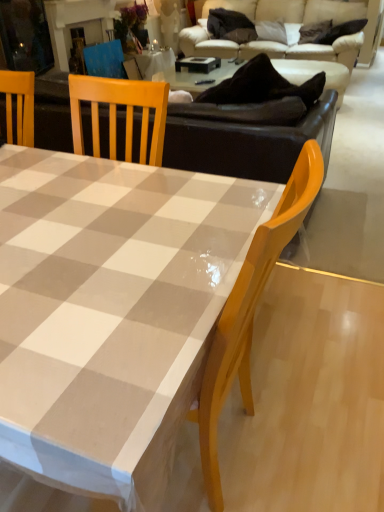
Question: In terms of height, does beige fabric couch at upper center look taller or shorter compared to white glossy table at center?

Choices:
 (A) tall
 (B) short

Answer: (A)

Question: Is beige fabric couch at upper center inside the boundaries of white glossy table at center, or outside?

Choices:
 (A) outside
 (B) inside

Answer: (A)

Question: Considering the positions of point (344, 61) and point (84, 434), is point (344, 61) closer or farther from the camera than point (84, 434)?

Choices:
 (A) closer
 (B) farther

Answer: (B)

Question: From the image's perspective, is white glossy table at center located above or below beige fabric couch at upper center?

Choices:
 (A) below
 (B) above

Answer: (A)

Question: Considering the positions of white glossy table at center and beige fabric couch at upper center in the image, is white glossy table at center taller or shorter than beige fabric couch at upper center?

Choices:
 (A) short
 (B) tall

Answer: (A)

Question: In the image, is white glossy table at center positioned in front of or behind beige fabric couch at upper center?

Choices:
 (A) behind
 (B) front

Answer: (B)

Question: Is point (84, 418) positioned closer to the camera than point (311, 46)?

Choices:
 (A) farther
 (B) closer

Answer: (B)